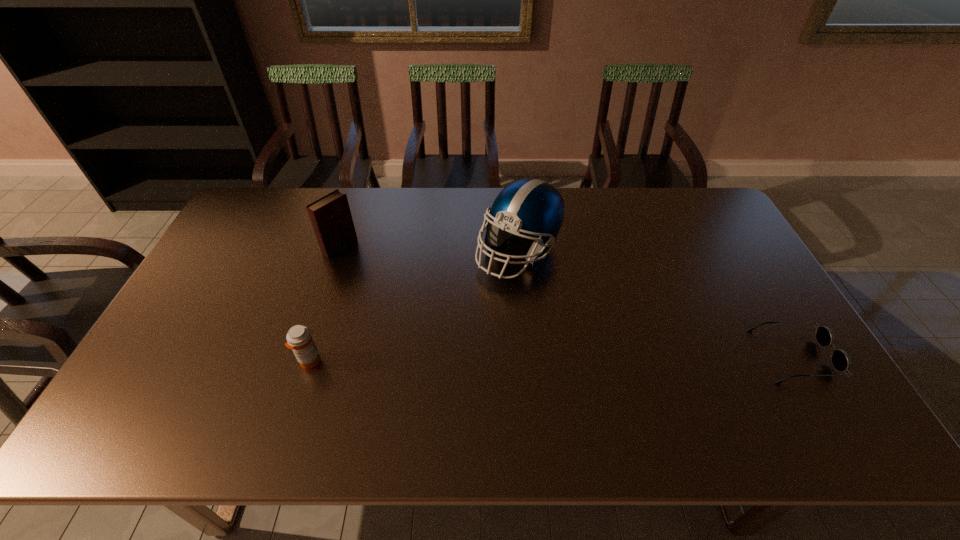
Locate an element on the screen. This screenshot has width=960, height=540. blank area located on the front cover of the second tallest object is located at coordinates (431, 309).

The image size is (960, 540). In order to click on vacant point located 0.220m on the front cover of the second tallest object in this screenshot , I will do tap(396, 286).

The height and width of the screenshot is (540, 960). In order to click on vacant space situated 0.250m on the front cover of the second tallest object in this screenshot , I will do `click(404, 291)`.

At what (x,y) coordinates should I click in order to perform the action: click on object at the far edge. Please return your answer as a coordinate pair (x, y). Looking at the image, I should click on [x=532, y=207].

The height and width of the screenshot is (540, 960). I want to click on medicine that is positioned at the near edge, so click(x=299, y=339).

Identify the location of sunglasses positioned at the near edge. Image resolution: width=960 pixels, height=540 pixels. (840, 360).

The image size is (960, 540). Find the location of `object at the right edge`. object at the right edge is located at coordinates (840, 360).

Find the location of `object that is at the near right corner`. object that is at the near right corner is located at coordinates point(840,360).

The width and height of the screenshot is (960, 540). What are the coordinates of `free space at the far edge of the desktop` in the screenshot? It's located at [x=588, y=208].

Where is `free space at the near edge`? Image resolution: width=960 pixels, height=540 pixels. free space at the near edge is located at coordinates (419, 383).